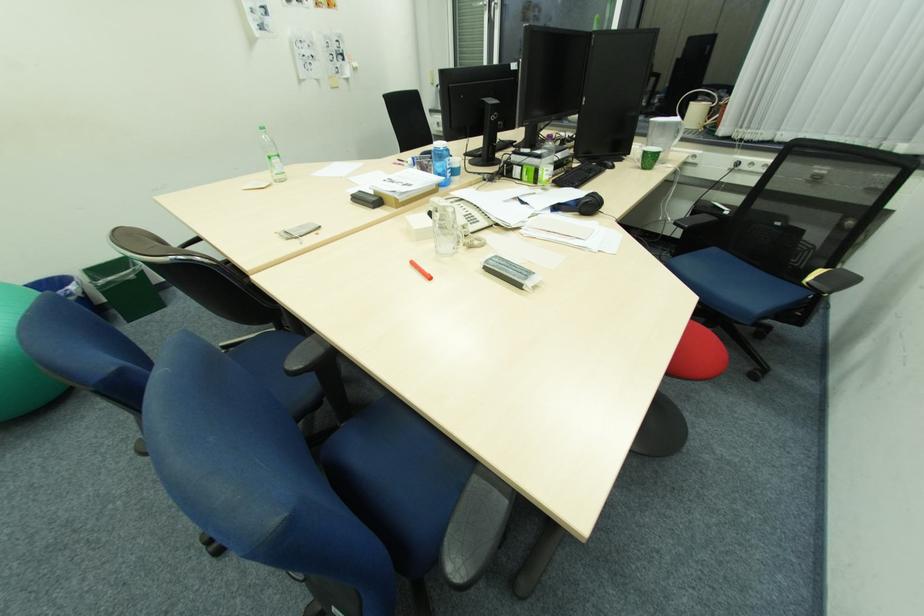
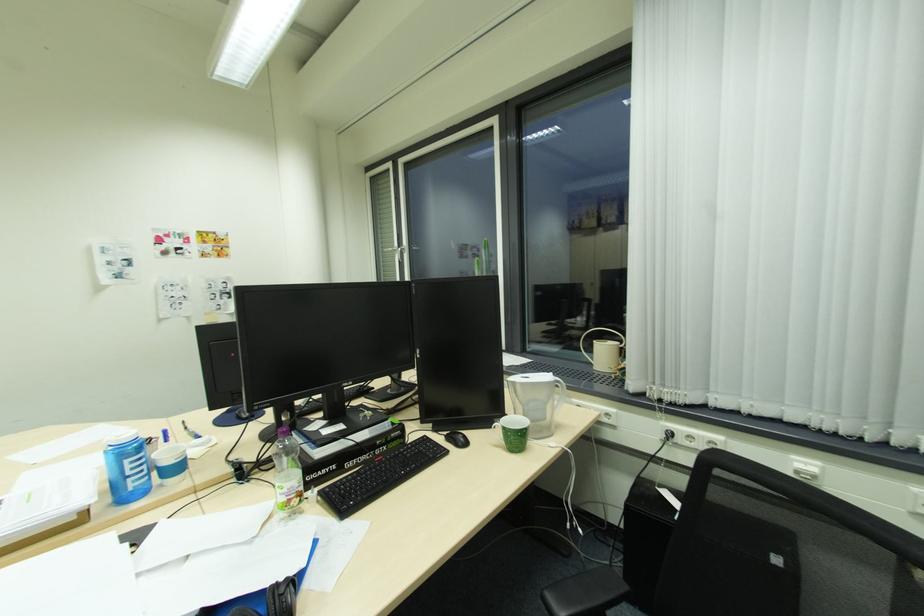
The point at (558, 185) is marked in the first image. Where is the corresponding point in the second image?

(324, 499)